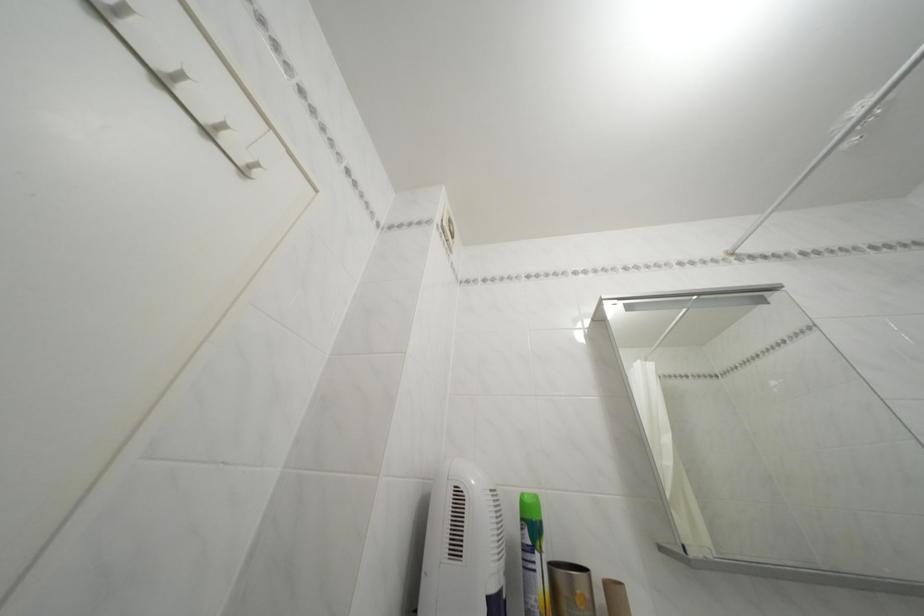
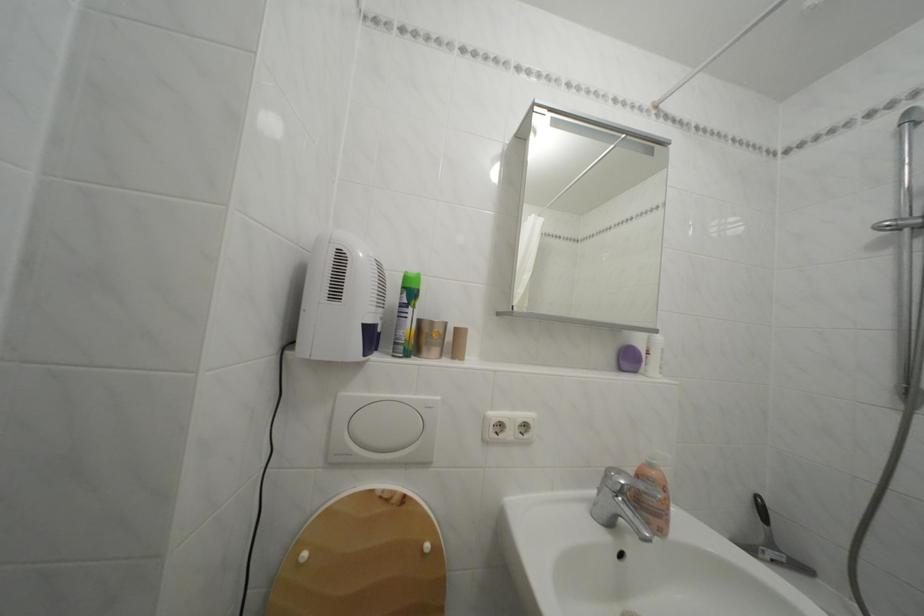
Based on the continuous images, in which direction is the camera rotating?

The camera's rotation is toward right-down.